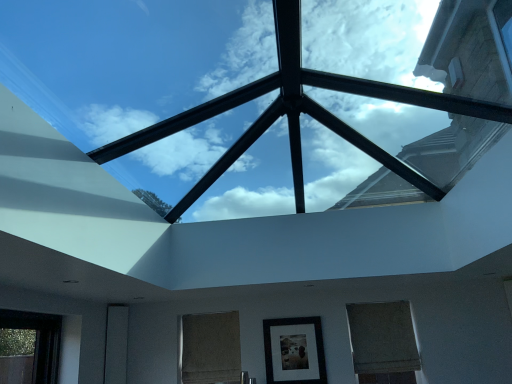
Question: Is burlap curtain at center, the 2th window in the right-to-left sequence, wider than transparent glass skylight at center?

Choices:
 (A) no
 (B) yes

Answer: (A)

Question: Can you confirm if burlap curtain at center, which is counted as the 1th window, starting from the left, is thinner than transparent glass skylight at center?

Choices:
 (A) no
 (B) yes

Answer: (B)

Question: Is burlap curtain at center, which is counted as the 1th window, starting from the left, positioned with its back to transparent glass skylight at center?

Choices:
 (A) no
 (B) yes

Answer: (A)

Question: Is burlap curtain at center, the 2th window in the right-to-left sequence, far from transparent glass skylight at center?

Choices:
 (A) no
 (B) yes

Answer: (B)

Question: Does burlap curtain at center, which is counted as the 1th window, starting from the left, have a smaller size compared to transparent glass skylight at center?

Choices:
 (A) no
 (B) yes

Answer: (B)

Question: Is the position of burlap curtain at center, the 2th window in the right-to-left sequence, less distant than that of transparent glass skylight at center?

Choices:
 (A) yes
 (B) no

Answer: (B)

Question: Can you confirm if transparent glass skylight at center is shorter than matte black glass door at lower left?

Choices:
 (A) no
 (B) yes

Answer: (B)

Question: Would you say matte black glass door at lower left is part of transparent glass skylight at center's contents?

Choices:
 (A) yes
 (B) no

Answer: (B)

Question: Is transparent glass skylight at center to the left of matte black glass door at lower left from the viewer's perspective?

Choices:
 (A) no
 (B) yes

Answer: (A)

Question: Could you tell me if transparent glass skylight at center is turned towards matte black glass door at lower left?

Choices:
 (A) yes
 (B) no

Answer: (B)

Question: From a real-world perspective, is transparent glass skylight at center on top of matte black glass door at lower left?

Choices:
 (A) yes
 (B) no

Answer: (A)

Question: Considering the relative sizes of transparent glass skylight at center and matte black glass door at lower left in the image provided, is transparent glass skylight at center taller than matte black glass door at lower left?

Choices:
 (A) yes
 (B) no

Answer: (B)

Question: Does matte black picture frame at center lie in front of burlap curtain at center, which is counted as the 1th window, starting from the left?

Choices:
 (A) no
 (B) yes

Answer: (B)